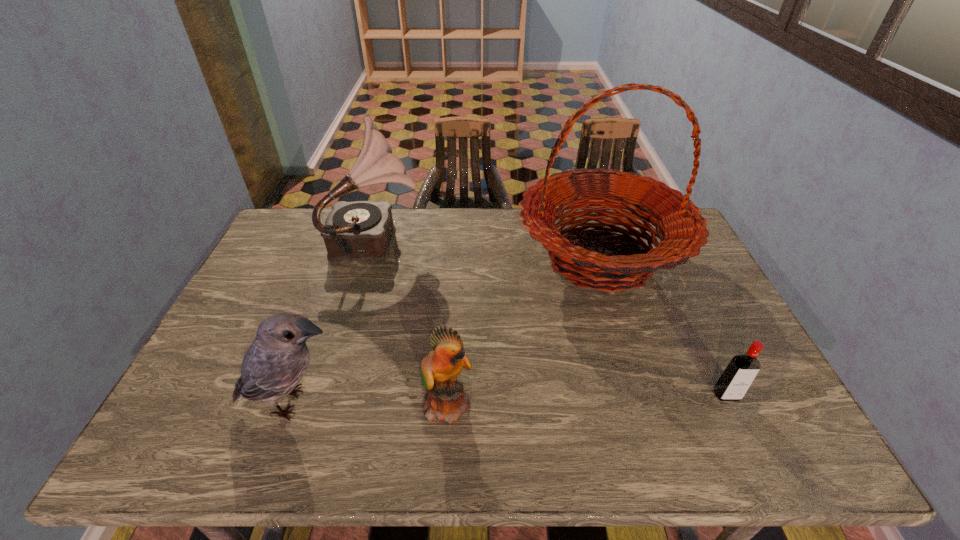
You are a GUI agent. You are given a task and a screenshot of the screen. Output one action in this format:
    pyautogui.click(x=<x>, y=<y>)
    Task: Click on the blank space at the right edge of the desktop
    The image size is (960, 540).
    Given the screenshot: What is the action you would take?
    pyautogui.click(x=705, y=273)

In order to click on vacant position at the near left corner of the desktop in this screenshot , I will do pos(161,430).

This screenshot has height=540, width=960. What are the coordinates of `vacant space in between the fourth shortest object and the left parrot` in the screenshot? It's located at (336, 321).

I want to click on blank region between the vodka and the third object from left to right, so click(x=588, y=400).

Locate an element on the screen. vacant point located between the third object from right to left and the record player is located at coordinates [x=414, y=321].

Locate an element on the screen. empty space between the right parrot and the vodka is located at coordinates (588, 400).

This screenshot has height=540, width=960. I want to click on vacant space in between the right parrot and the basket, so click(x=524, y=331).

Locate an element on the screen. The image size is (960, 540). vacant space in between the left parrot and the right parrot is located at coordinates (371, 403).

In order to click on vacant region between the right parrot and the left parrot in this screenshot , I will do `click(371, 403)`.

You are a GUI agent. You are given a task and a screenshot of the screen. Output one action in this format:
    pyautogui.click(x=<x>, y=<y>)
    Task: Click on the vacant point located between the record player and the left parrot
    Image resolution: width=960 pixels, height=540 pixels.
    Given the screenshot: What is the action you would take?
    click(336, 321)